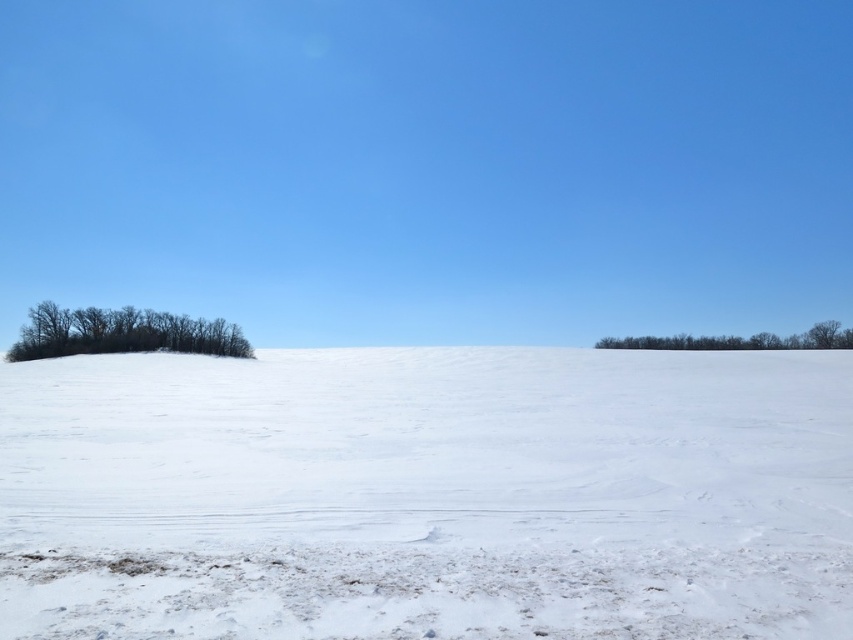
Which of these two, bare branches at left or green leafy trees at right, stands taller?

Standing taller between the two is bare branches at left.

Who is higher up, bare branches at left or green leafy trees at right?

bare branches at left is higher up.

Is point (28, 326) more distant than point (616, 346)?

That is False.

Identify the location of bare branches at left. Image resolution: width=853 pixels, height=640 pixels. (122, 332).

Which of these two, white powdery snow at center or bare branches at left, stands shorter?

Standing shorter between the two is white powdery snow at center.

Measure the distance from white powdery snow at center to bare branches at left.

white powdery snow at center is 48.43 meters from bare branches at left.

Identify the location of white powdery snow at center. (427, 493).

Is white powdery snow at center above green leafy trees at right?

Incorrect, white powdery snow at center is not positioned above green leafy trees at right.

Who is more forward, (318,460) or (743,348)?

Point (318,460)

Who is more distant from viewer, (241, 474) or (616, 342)?

The point (616, 342) is more distant.

At what (x,y) coordinates should I click in order to perform the action: click on white powdery snow at center. Please return your answer as a coordinate pair (x, y). Looking at the image, I should click on (427, 493).